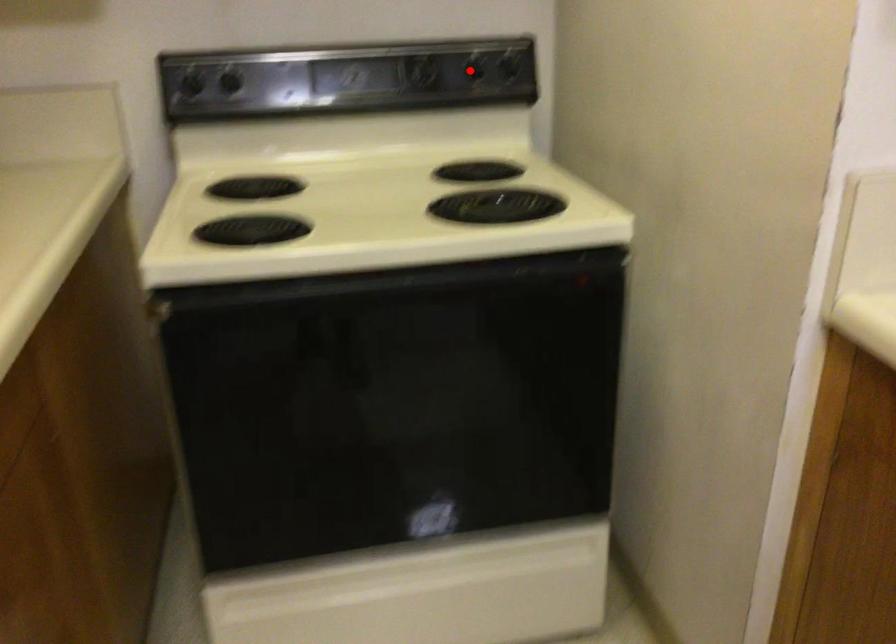
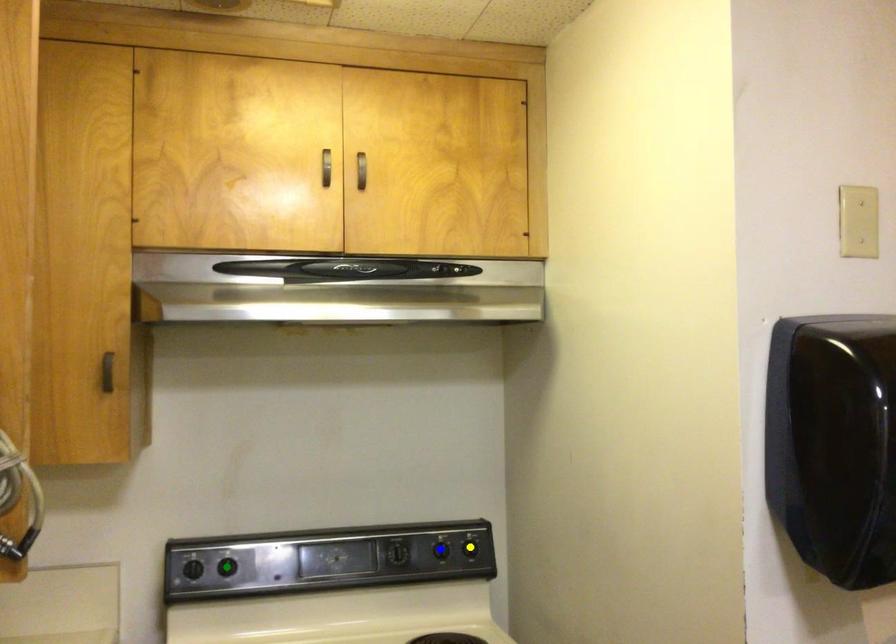
Question: I am providing you with two images of the same scene from different viewpoints. A red point is marked on the first image. You are given multiple points on the second image. Which point in image 2 represents the same 3d spot as the red point in image 1?

Choices:
 (A) yellow point
 (B) green point
 (C) blue point

Answer: (C)